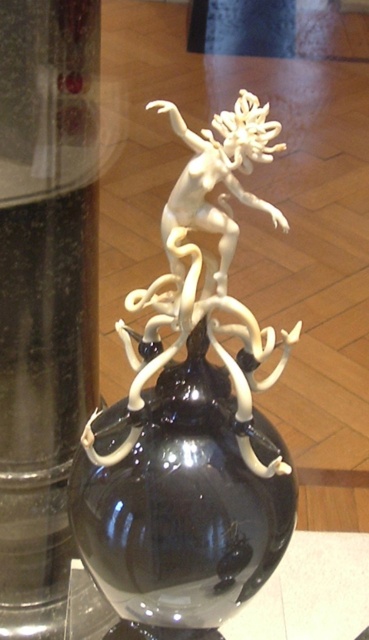
From the picture: Who is positioned more to the left, black glass vase at center or transparent glass table at lower center?

black glass vase at center

Does black glass vase at center appear on the left side of transparent glass table at lower center?

Indeed, black glass vase at center is positioned on the left side of transparent glass table at lower center.

Which is behind, point (194, 584) or point (367, 572)?

Point (367, 572)

Image resolution: width=369 pixels, height=640 pixels. Find the location of `black glass vase at center`. black glass vase at center is located at coordinates (184, 508).